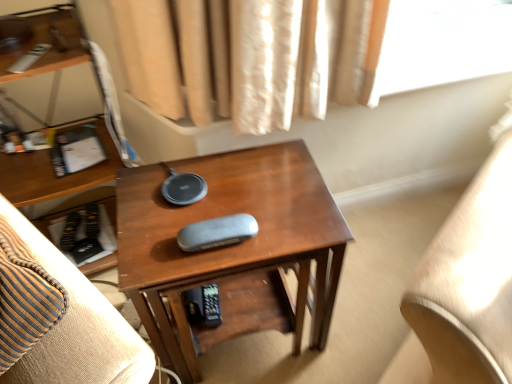
Where is `vacant space situated above shiny brown desk at center (from a real-world perspective)`? This screenshot has width=512, height=384. vacant space situated above shiny brown desk at center (from a real-world perspective) is located at coordinates (230, 194).